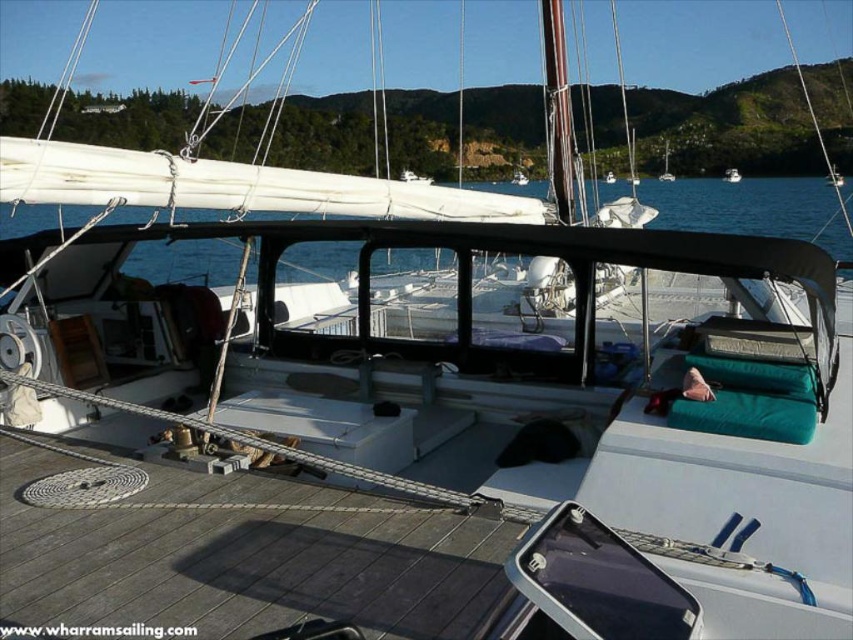
You are standing on the deck of the sailboat and want to step onto the transparent water at center. Is the point at coordinate (751, 209) on the transparent water at center?

Yes, the point at coordinate (751, 209) is on the transparent water at center according to the description.